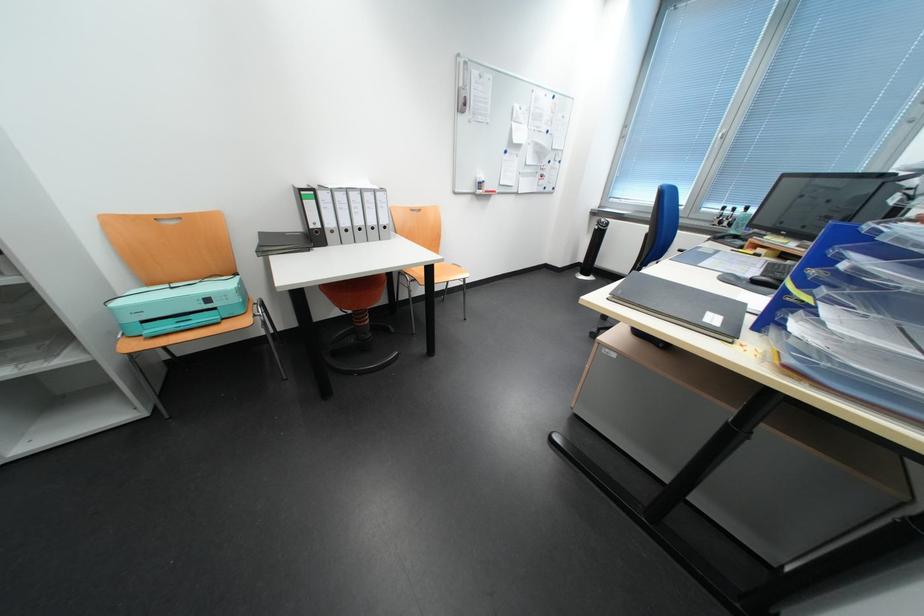
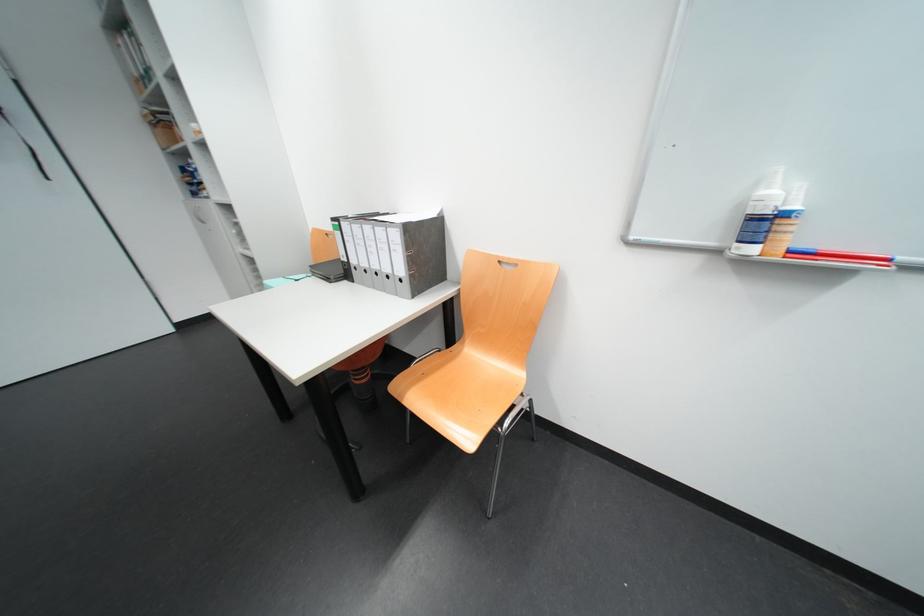
The point at (489, 177) is marked in the first image. Where is the corresponding point in the second image?

(773, 193)